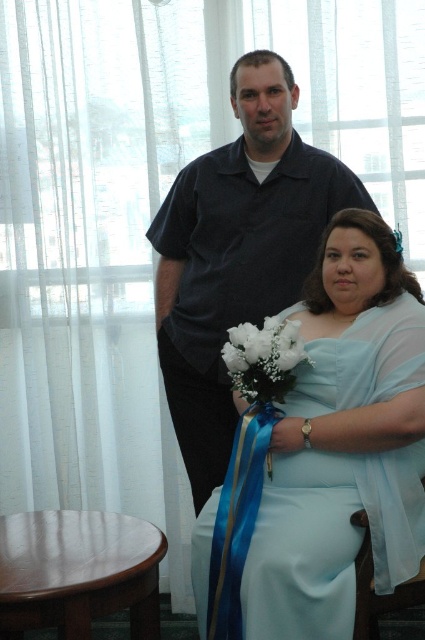
You are a photographer setting up for a portrait. You need to place a small light between the brown wooden stool at lower left and the white silk bouquet at lower center. Based on their positions, which object should the light be closer to?

The light should be placed closer to the brown wooden stool at lower left because it is closer to the viewer than the white silk bouquet at lower center.

You are a photographer at a formal event. You want to capture a closeup shot of the blue satin ribbon at lower center while ensuring the light blue satin dress at lower center remains in the frame. Given the distance between them is 4.38 inches, what is the minimum focal length lens you should use if your camera sensor has a diagonal of 1.5 inches and you want both objects to fit within the frame?

The minimum focal length lens required is calculated using the formula focal length equals sensor diagonal multiplied by distance between objects divided by sensor diagonal. However, since both objects are within 4.38 inches apart and the sensor diagonal is 1.5 inches, a lens with focal length shorter than 1.5 inches would be needed to capture both. But standard camera lenses typically have focal lengths starting around 24mm or higher. This suggests either the distance measurement is in camera sensor terms,

You are a photographer at a formal event. You need to adjust the lighting to ensure both the light blue satin dress at lower center and the blue satin ribbon at lower center are well lit. Based on their positions, which object should you focus on first to ensure proper lighting?

The light blue satin dress at lower center is above the blue satin ribbon at lower center, so you should focus on lighting the light blue satin dress at lower center first as it is higher and might cast shadows on the lower ribbon.